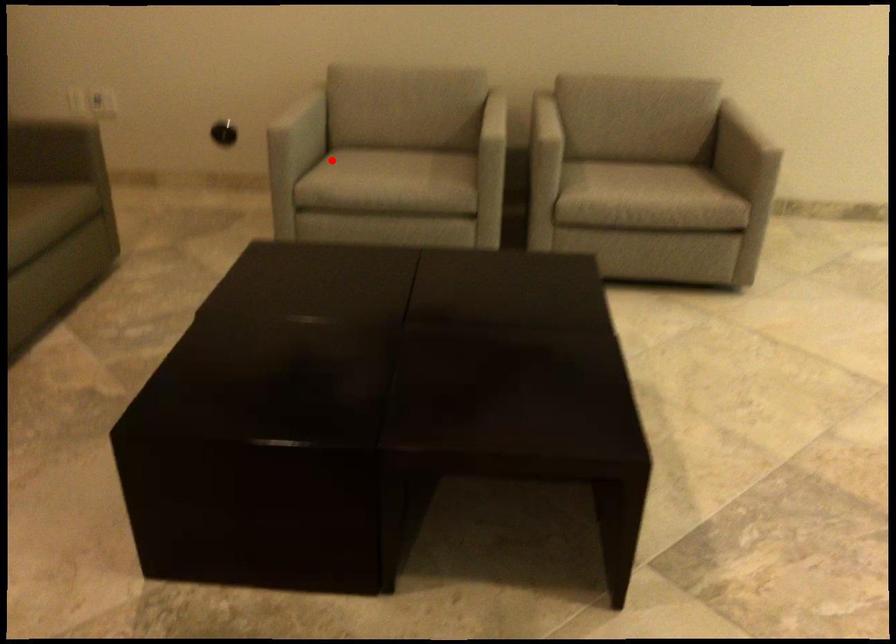
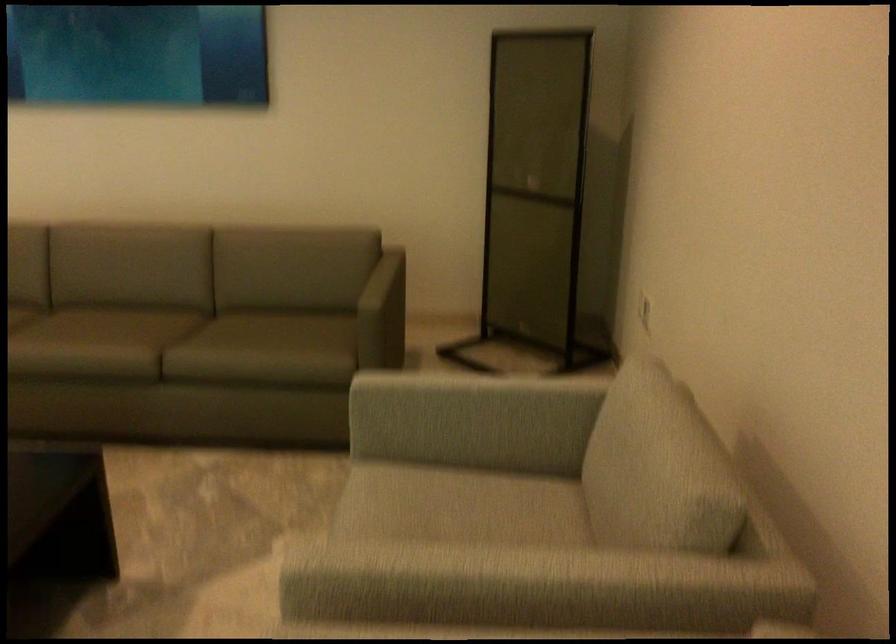
Where in the second image is the point corresponding to the highlighted location from the first image?

(455, 491)